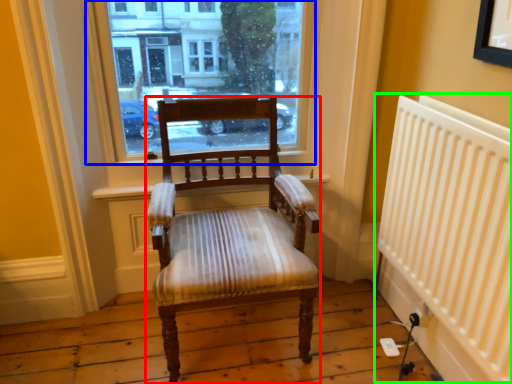
Question: Which object is the closest to the chair (highlighted by a red box)? Choose among these: window (highlighted by a blue box) or radiator (highlighted by a green box).

Choices:
 (A) window
 (B) radiator

Answer: (A)